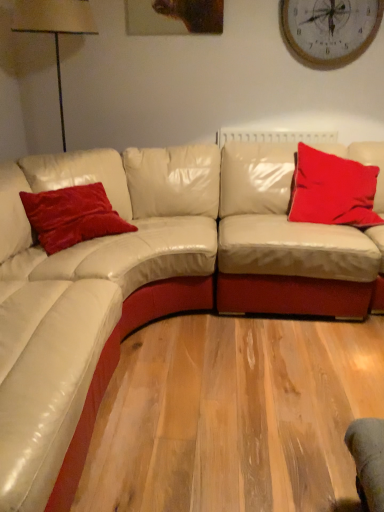
The width and height of the screenshot is (384, 512). What do you see at coordinates (54, 27) in the screenshot?
I see `beige fabric lampshade at left` at bounding box center [54, 27].

At what (x,y) coordinates should I click in order to perform the action: click on velvet red pillow at left, which is the 1th pillow from left to right. Please return your answer as a coordinate pair (x, y). The height and width of the screenshot is (512, 384). Looking at the image, I should click on (72, 216).

Between velvet red pillow at left, the 2th pillow when ordered from right to left, and velvet red pillow at upper right, marked as the 1th pillow in a right-to-left arrangement, which one has smaller width?

Thinner between the two is velvet red pillow at left, the 2th pillow when ordered from right to left.

Which is closer, (x=125, y=221) or (x=319, y=222)?

Point (x=319, y=222)

Can you confirm if velvet red pillow at left, the 2th pillow when ordered from right to left, is positioned to the right of velvet red pillow at upper right, which is the second pillow in left-to-right order?

No.

Locate an element on the screen. This screenshot has width=384, height=512. table lamp lying on the left of velvet red pillow at left, which is the 1th pillow from left to right is located at coordinates (54, 27).

From the picture: Is beige fabric lampshade at left at the back of velvet red pillow at left, the 2th pillow when ordered from right to left?

No, velvet red pillow at left, the 2th pillow when ordered from right to left, is not facing the opposite direction of beige fabric lampshade at left.

Considering the sizes of objects velvet red pillow at left, the 2th pillow when ordered from right to left, and beige fabric lampshade at left in the image provided, who is wider, velvet red pillow at left, the 2th pillow when ordered from right to left, or beige fabric lampshade at left?

Wider between the two is beige fabric lampshade at left.

Is velvet red pillow at left, which is the 1th pillow from left to right, oriented away from white leather couch at center?

velvet red pillow at left, which is the 1th pillow from left to right, does not have its back to white leather couch at center.

What's the angular difference between velvet red pillow at left, which is the 1th pillow from left to right, and white leather couch at center's facing directions?

velvet red pillow at left, which is the 1th pillow from left to right, and white leather couch at center are facing 133 degrees away from each other.

Is velvet red pillow at left, the 2th pillow when ordered from right to left, next to white leather couch at center?

They are not placed beside each other.

From the image's perspective, is velvet red pillow at left, the 2th pillow when ordered from right to left, located beneath white leather couch at center?

Actually, velvet red pillow at left, the 2th pillow when ordered from right to left, appears above white leather couch at center in the image.

In the scene shown: Is velvet red pillow at left, the 2th pillow when ordered from right to left, not inside wooden clock at upper center?

Absolutely, velvet red pillow at left, the 2th pillow when ordered from right to left, is external to wooden clock at upper center.

Considering the sizes of objects velvet red pillow at left, which is the 1th pillow from left to right, and wooden clock at upper center in the image provided, who is thinner, velvet red pillow at left, which is the 1th pillow from left to right, or wooden clock at upper center?

With smaller width is wooden clock at upper center.

Which point is more distant from viewer, (x=128, y=226) or (x=366, y=7)?

The point (x=366, y=7) is more distant.

Between velvet red pillow at left, the 2th pillow when ordered from right to left, and wooden clock at upper center, which one is positioned behind?

wooden clock at upper center.

Which point is more forward, (65, 145) or (359, 22)?

Answer: The point (359, 22) is closer.

Does beige fabric lampshade at left appear on the left side of wooden clock at upper center?

Yes.

From the image's perspective, relative to wooden clock at upper center, is beige fabric lampshade at left above or below?

From the image's perspective, beige fabric lampshade at left appears below wooden clock at upper center.

Can you tell me how much beige fabric lampshade at left and wooden clock at upper center differ in facing direction?

The facing directions of beige fabric lampshade at left and wooden clock at upper center are 0.00458 degrees apart.

Is white leather couch at center aimed at beige fabric lampshade at left?

No, white leather couch at center is not facing towards beige fabric lampshade at left.

In the scene shown: Can beige fabric lampshade at left be found inside white leather couch at center?

Actually, beige fabric lampshade at left is outside white leather couch at center.

Is point (166, 287) closer or farther from the camera than point (47, 25)?

Point (166, 287) appears to be closer to the viewer than point (47, 25).

Considering the sizes of objects white leather couch at center and beige fabric lampshade at left in the image provided, who is thinner, white leather couch at center or beige fabric lampshade at left?

With smaller width is beige fabric lampshade at left.

In the scene shown: Considering the relative sizes of wooden clock at upper center and velvet red pillow at left, the 2th pillow when ordered from right to left, in the image provided, is wooden clock at upper center shorter than velvet red pillow at left, the 2th pillow when ordered from right to left,?

No.

Is velvet red pillow at left, which is the 1th pillow from left to right, surrounded by wooden clock at upper center?

No, velvet red pillow at left, which is the 1th pillow from left to right, is not surrounded by wooden clock at upper center.

Which is behind, wooden clock at upper center or velvet red pillow at left, which is the 1th pillow from left to right?

wooden clock at upper center is more distant.

How many degrees apart are the facing directions of wooden clock at upper center and velvet red pillow at left, which is the 1th pillow from left to right?

43.9 degrees separate the facing orientations of wooden clock at upper center and velvet red pillow at left, which is the 1th pillow from left to right.

Identify the location of pillow in front of the velvet red pillow at upper right, which is the second pillow in left-to-right order. pos(72,216).

I want to click on table lamp to the left of velvet red pillow at left, the 2th pillow when ordered from right to left, so click(54, 27).

Based on their spatial positions, is white leather couch at center or velvet red pillow at upper right, marked as the 1th pillow in a right-to-left arrangement, closer to velvet red pillow at left, which is the 1th pillow from left to right?

The object closer to velvet red pillow at left, which is the 1th pillow from left to right, is white leather couch at center.

Looking at the image, which one is located further to beige fabric lampshade at left, velvet red pillow at left, the 2th pillow when ordered from right to left, or white leather couch at center?

white leather couch at center is further to beige fabric lampshade at left.

Looking at the image, which one is located further to velvet red pillow at left, the 2th pillow when ordered from right to left, beige fabric lampshade at left or wooden clock at upper center?

wooden clock at upper center.

Which object lies further to the anchor point velvet red pillow at left, the 2th pillow when ordered from right to left, wooden clock at upper center or beige fabric lampshade at left?

wooden clock at upper center is further to velvet red pillow at left, the 2th pillow when ordered from right to left.

From the image, which object appears to be farther from white leather couch at center, beige fabric lampshade at left or velvet red pillow at upper right, which is the second pillow in left-to-right order?

beige fabric lampshade at left.

Estimate the real-world distances between objects in this image. Which object is further from beige fabric lampshade at left, white leather couch at center or wooden clock at upper center?

wooden clock at upper center is further to beige fabric lampshade at left.

Considering their positions, is velvet red pillow at upper right, marked as the 1th pillow in a right-to-left arrangement, positioned closer to beige fabric lampshade at left than velvet red pillow at left, which is the 1th pillow from left to right?

velvet red pillow at left, which is the 1th pillow from left to right, is closer to beige fabric lampshade at left.

When comparing their distances from beige fabric lampshade at left, does velvet red pillow at upper right, which is the second pillow in left-to-right order, or wooden clock at upper center seem closer?

wooden clock at upper center.

Image resolution: width=384 pixels, height=512 pixels. In order to click on table lamp between wooden clock at upper center and white leather couch at center from top to bottom in this screenshot , I will do `click(54, 27)`.

Where is `studio couch between beige fabric lampshade at left and velvet red pillow at upper right, marked as the 1th pillow in a right-to-left arrangement, from left to right`? The image size is (384, 512). studio couch between beige fabric lampshade at left and velvet red pillow at upper right, marked as the 1th pillow in a right-to-left arrangement, from left to right is located at coordinates [x=152, y=278].

Identify the location of pillow situated between beige fabric lampshade at left and velvet red pillow at upper right, marked as the 1th pillow in a right-to-left arrangement, from left to right. The width and height of the screenshot is (384, 512). (72, 216).

Locate an element on the screen. studio couch situated between velvet red pillow at left, the 2th pillow when ordered from right to left, and velvet red pillow at upper right, marked as the 1th pillow in a right-to-left arrangement, from left to right is located at coordinates (152, 278).